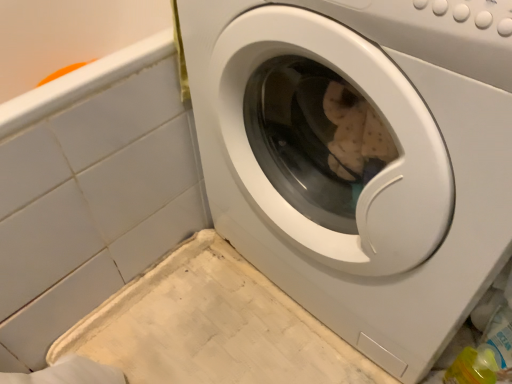
Question: From the image's perspective, is white glossy washing machine at center located beneath white glossy washing machine at center?

Choices:
 (A) yes
 (B) no

Answer: (A)

Question: From the image's perspective, is white glossy washing machine at center on white glossy washing machine at center?

Choices:
 (A) yes
 (B) no

Answer: (B)

Question: Considering the relative sizes of white glossy washing machine at center and white glossy washing machine at center in the image provided, is white glossy washing machine at center smaller than white glossy washing machine at center?

Choices:
 (A) yes
 (B) no

Answer: (A)

Question: Can you see white glossy washing machine at center touching white glossy washing machine at center?

Choices:
 (A) yes
 (B) no

Answer: (B)

Question: Is white glossy washing machine at center thinner than white glossy washing machine at center?

Choices:
 (A) yes
 (B) no

Answer: (A)

Question: Does white glossy washing machine at center have a greater width compared to white glossy washing machine at center?

Choices:
 (A) no
 (B) yes

Answer: (A)

Question: Considering the relative sizes of white glossy washing machine at center and white glossy washing machine at center in the image provided, is white glossy washing machine at center taller than white glossy washing machine at center?

Choices:
 (A) yes
 (B) no

Answer: (B)

Question: Considering the relative sizes of white glossy washing machine at center and white glossy washing machine at center in the image provided, is white glossy washing machine at center shorter than white glossy washing machine at center?

Choices:
 (A) yes
 (B) no

Answer: (A)

Question: Considering the relative sizes of white glossy washing machine at center and white glossy washing machine at center in the image provided, is white glossy washing machine at center bigger than white glossy washing machine at center?

Choices:
 (A) no
 (B) yes

Answer: (B)

Question: Is white glossy washing machine at center at the left side of white glossy washing machine at center?

Choices:
 (A) no
 (B) yes

Answer: (B)

Question: Is the depth of white glossy washing machine at center less than that of white glossy washing machine at center?

Choices:
 (A) no
 (B) yes

Answer: (A)

Question: Considering the relative sizes of white glossy washing machine at center and white glossy washing machine at center in the image provided, is white glossy washing machine at center smaller than white glossy washing machine at center?

Choices:
 (A) yes
 (B) no

Answer: (B)

Question: Looking at the image, does white glossy washing machine at center seem bigger or smaller compared to white glossy washing machine at center?

Choices:
 (A) big
 (B) small

Answer: (B)